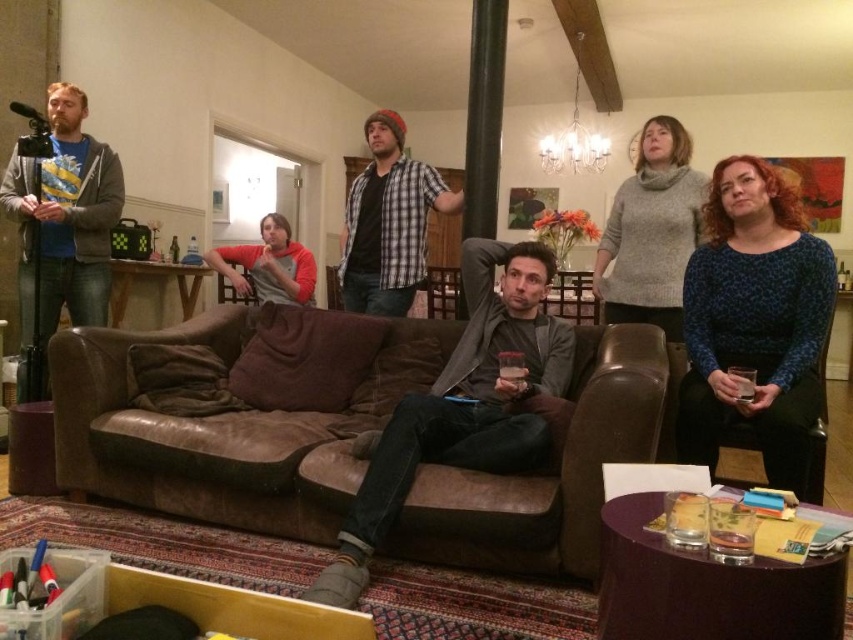
Which is more to the left, blue dotted sweater at right or brown leather armchair at center?

brown leather armchair at center is more to the left.

Does point (755, 385) lie in front of point (219, 301)?

Yes, point (755, 385) is closer to viewer.

What are the coordinates of `blue dotted sweater at right` in the screenshot? It's located at (753, 321).

Between matte gray hoodie at left and black fabric armchair at right, which one is positioned higher?

matte gray hoodie at left

From the picture: Is matte gray hoodie at left thinner than black fabric armchair at right?

No, matte gray hoodie at left is not thinner than black fabric armchair at right.

Who is more forward, (57, 136) or (814, 392)?

Point (814, 392) is more forward.

Locate an element on the screen. This screenshot has width=853, height=640. matte gray hoodie at left is located at coordinates (62, 220).

Is brown leather couch at center above blue dotted sweater at right?

No, brown leather couch at center is not above blue dotted sweater at right.

Between point (573, 499) and point (728, 301), which one is positioned behind?

Positioned behind is point (728, 301).

Where is `brown leather couch at center`? The image size is (853, 640). brown leather couch at center is located at coordinates coord(219,429).

Locate an element on the screen. The width and height of the screenshot is (853, 640). brown leather couch at center is located at coordinates 219,429.